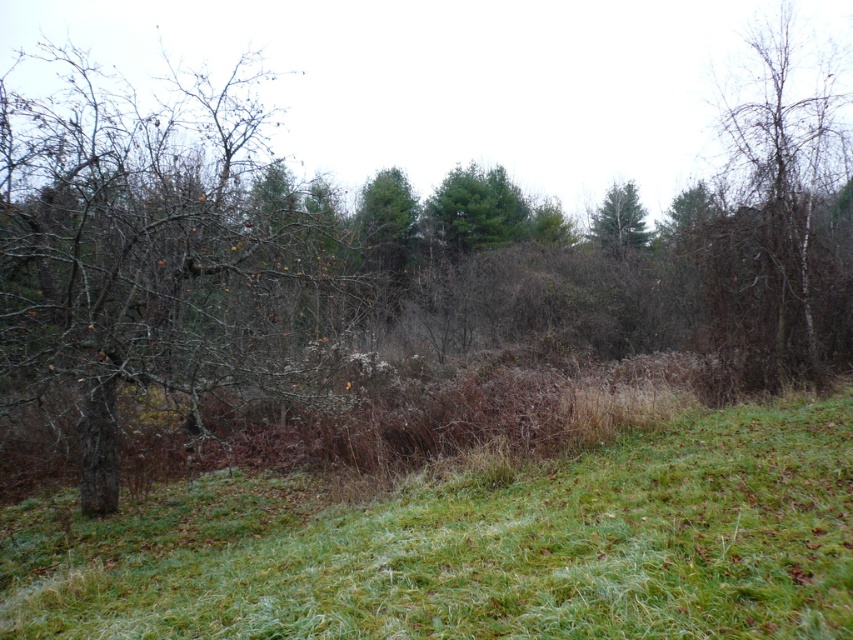
Is point (194, 433) positioned before point (772, 209)?

No, it is behind (772, 209).

Can you confirm if brown bark tree at left is smaller than bare branches at right?

No.

You are a GUI agent. You are given a task and a screenshot of the screen. Output one action in this format:
    pyautogui.click(x=<x>, y=<y>)
    Task: Click on the brown bark tree at left
    This screenshot has width=853, height=640.
    Given the screenshot: What is the action you would take?
    pyautogui.click(x=155, y=257)

Consider the image. Does brown bark tree at left have a smaller size compared to green matte tree at upper center?

Incorrect, brown bark tree at left is not smaller in size than green matte tree at upper center.

Is point (271, 278) farther from viewer compared to point (605, 195)?

No, (271, 278) is closer to viewer.

Is point (241, 205) farther from viewer compared to point (618, 232)?

No.

Where is `brown bark tree at left`? Image resolution: width=853 pixels, height=640 pixels. brown bark tree at left is located at coordinates (155, 257).

Is point (264, 548) positioned behind point (822, 74)?

No, (264, 548) is in front of (822, 74).

Is the position of green grass at center less distant than that of bare branches at right?

Yes, it is in front of bare branches at right.

Where is `green grass at center`? green grass at center is located at coordinates (474, 547).

You are a GUI agent. You are given a task and a screenshot of the screen. Output one action in this format:
    pyautogui.click(x=<x>, y=<y>)
    Task: Click on the green grass at center
    This screenshot has width=853, height=640.
    Given the screenshot: What is the action you would take?
    pyautogui.click(x=474, y=547)